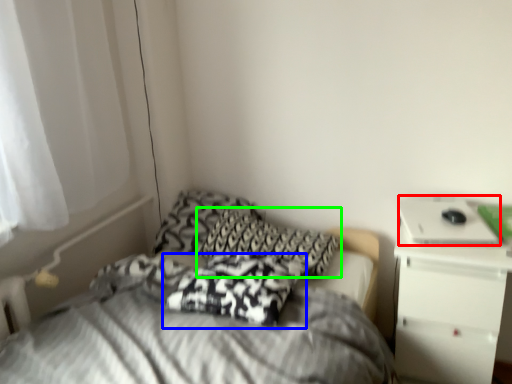
Question: Which object is the closest to the laptop (highlighted by a red box)? Choose among these: pillow (highlighted by a blue box) or pillow (highlighted by a green box).

Choices:
 (A) pillow
 (B) pillow

Answer: (B)